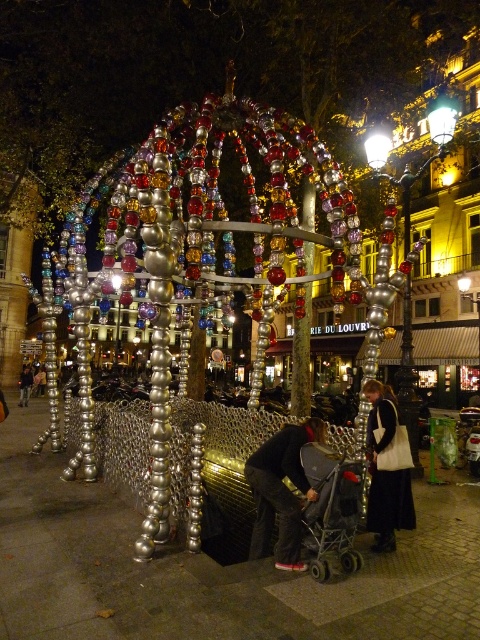
You are a parent pushing a stroller and need to navigate through the festive structure. Given the coordinates of the dark gray fabric stroller at center, can you determine if it will fit through the entrance of the structure?

The dark gray fabric stroller at center is located at point (280, 492). Since the structure is a dome made of metallic spheres and tubes with a base supported by a chain link fence, the entrance width is not specified. Without knowing the entrance dimensions, it is impossible to determine if the stroller will fit. Please check the entrance width before proceeding.

You are standing at the center of the scene. There is a point marked at coordinates point (192, 248). What object is located at that point?

The point (192, 248) marks shiny metallic beads at center.

You are standing at the point marked by the coordinates point (x=259, y=516) in the image. The structure in the background is a temporary installation for a festival. If you want to move closer to the structure, which direction should you move in relation to your current position?

To move closer to the structure, you should move towards the direction away from the point (x=259, y=516) since you are currently 38.02 meters away from the structure.